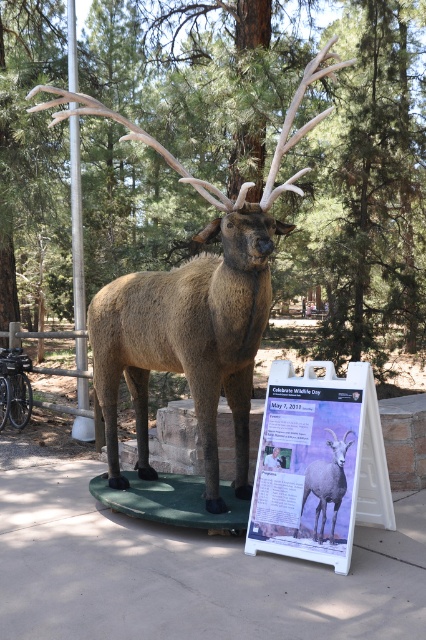
You are a visitor at the park and see the matte white signboard at center and the gray woolly sheep at center. Which object is positioned higher relative to the other?

The matte white signboard at center is above the gray woolly sheep at center, so it is positioned higher.

You are standing at the point marked by the coordinates [192,305] in the image. What object are you currently standing on?

You are standing on the brown matte deer at center.

You are standing at the center of the image. The brown matte deer at center is located at coordinates 0.477, 0.453. If you want to walk directly towards the deer, which direction should you move? Please provide your answer in terms of compass directions like north, south, east, west, northeast, etc.

Since you are already at the center of the image and the brown matte deer at center is also located at the center coordinates, you don not need to move in any direction to reach it. You are already facing the deer.